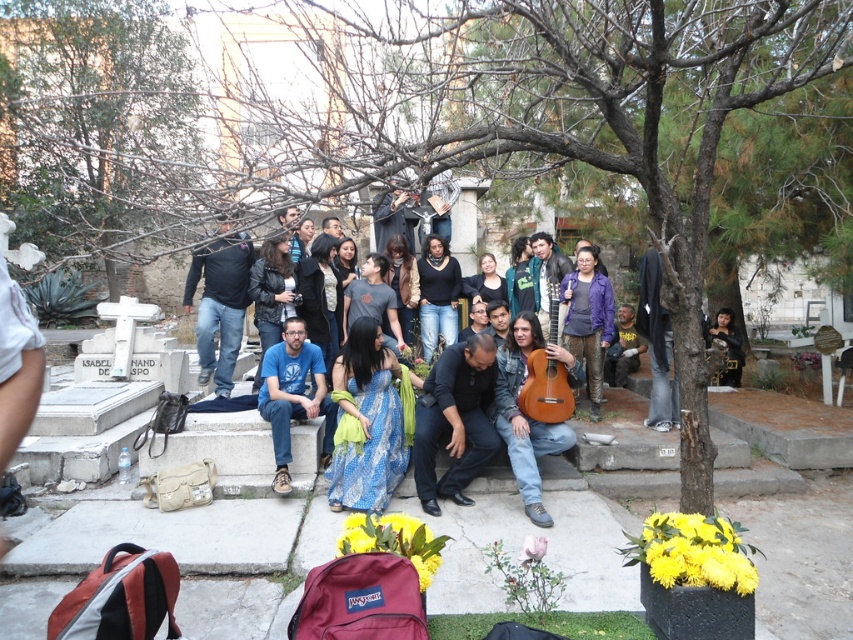
Is blue cotton shirt at center taller than purple metallic guitar at center?

In fact, blue cotton shirt at center may be shorter than purple metallic guitar at center.

Can you confirm if blue cotton shirt at center is positioned below purple metallic guitar at center?

Yes.

Where is `blue cotton shirt at center`? The image size is (853, 640). blue cotton shirt at center is located at coordinates (293, 396).

Can you confirm if blue batik dress at center is positioned above purple metallic guitar at center?

Actually, blue batik dress at center is below purple metallic guitar at center.

Between blue batik dress at center and purple metallic guitar at center, which one is positioned lower?

blue batik dress at center

Is point (368, 445) positioned after point (598, 282)?

No.

Where is `blue batik dress at center`? This screenshot has width=853, height=640. blue batik dress at center is located at coordinates (366, 422).

Who is taller, brown leafless branches at upper left or blue batik dress at center?

brown leafless branches at upper left is taller.

How distant is brown leafless branches at upper left from blue batik dress at center?

brown leafless branches at upper left is 5.65 meters away from blue batik dress at center.

Does point (71, 92) come closer to viewer compared to point (376, 332)?

That is False.

Locate an element on the screen. The height and width of the screenshot is (640, 853). brown leafless branches at upper left is located at coordinates 96,125.